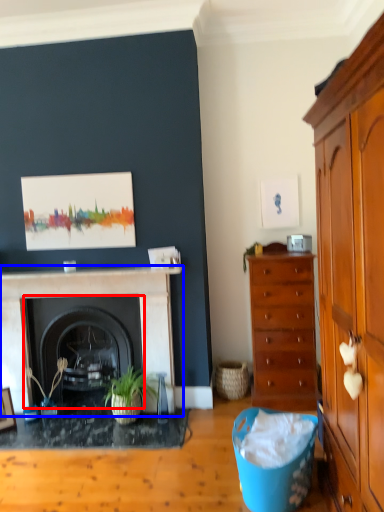
Question: Which object is further to the camera taking this photo, fireplace (highlighted by a red box) or fireplace (highlighted by a blue box)?

Choices:
 (A) fireplace
 (B) fireplace

Answer: (A)